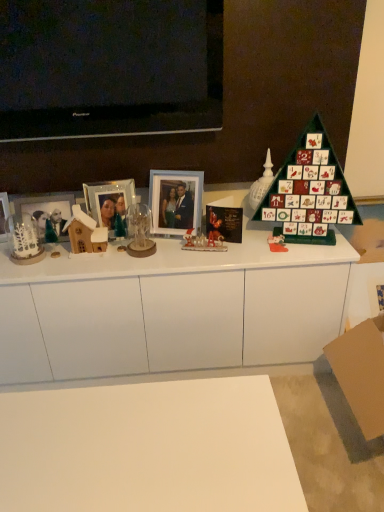
Find the location of a particular element. empty space that is to the right of wooden house at left, which appears as the 2th toy when viewed from the left is located at coordinates (129, 259).